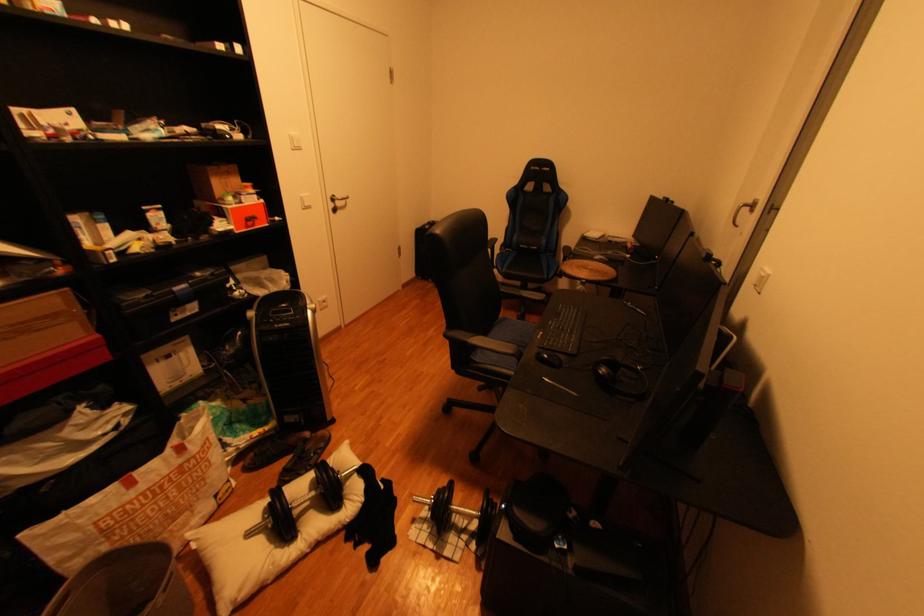
Find where to resting arm the chair armrest. Please return your answer as a coordinate pair (x, y).

(484, 342)